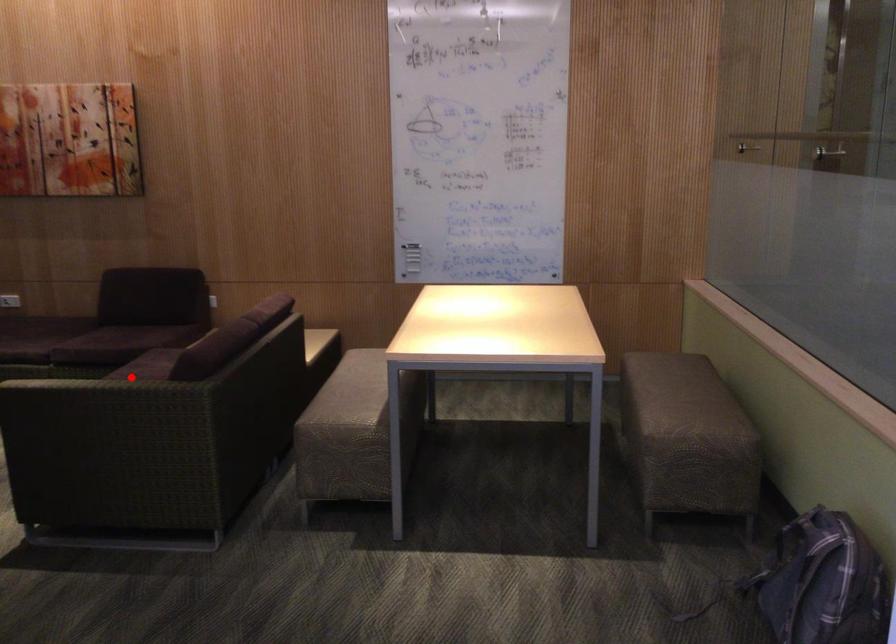
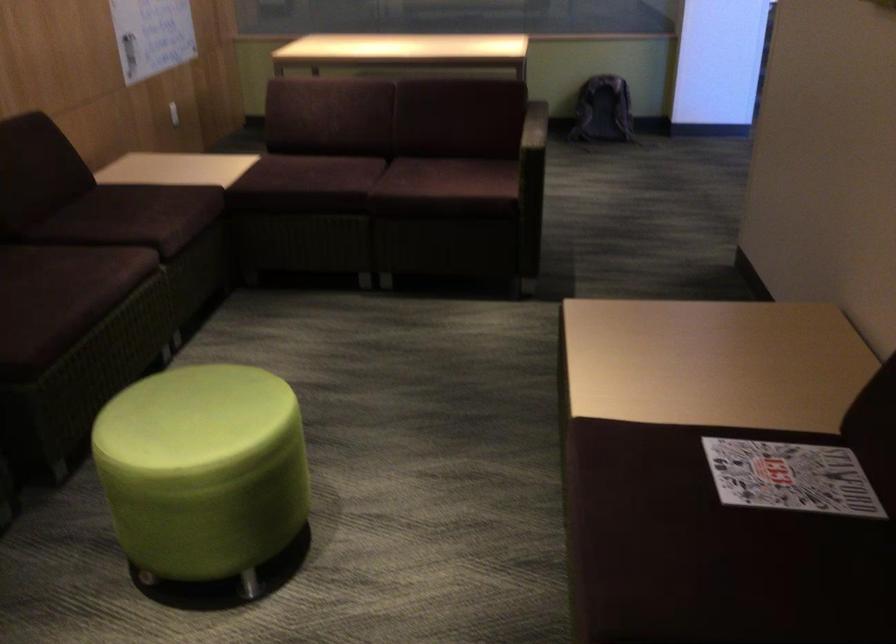
Question: A red point is marked in image1. In image2, is the corresponding 3D point closer to the camera or farther? Reply with the corresponding letter.

Choices:
 (A) The corresponding 3D point is closer.
 (B) The corresponding 3D point is farther.

Answer: (A)